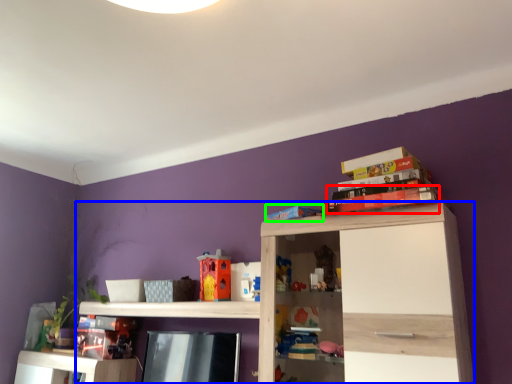
Question: Which is farther away from book (highlighted by a red box)? shelf (highlighted by a blue box) or book (highlighted by a green box)?

Choices:
 (A) shelf
 (B) book

Answer: (A)